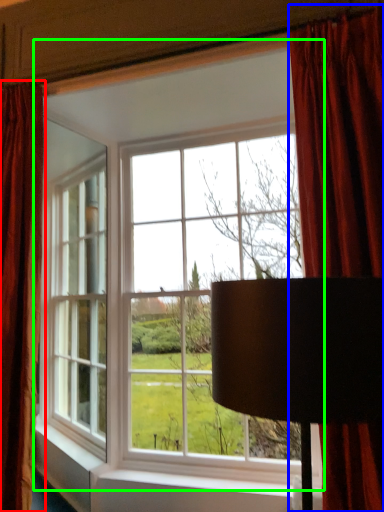
Question: Based on their relative distances, which object is farther from curtain (highlighted by a red box)? Choose from curtain (highlighted by a blue box) and window (highlighted by a green box).

Choices:
 (A) curtain
 (B) window

Answer: (A)